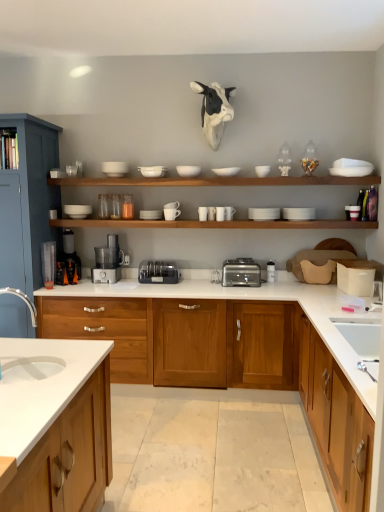
Image resolution: width=384 pixels, height=512 pixels. What do you see at coordinates (352, 212) in the screenshot?
I see `white matte cup at upper right, marked as the 14th tableware in a left-to-right arrangement` at bounding box center [352, 212].

This screenshot has width=384, height=512. Describe the element at coordinates (241, 273) in the screenshot. I see `silver metallic toaster at center` at that location.

In the scene shown: Measure the distance between point (x=260, y=172) and camera.

The distance of point (x=260, y=172) from camera is 3.59 meters.

Image resolution: width=384 pixels, height=512 pixels. Describe the element at coordinates (229, 213) in the screenshot. I see `white matte mug at center, marked as the tenth tableware in a left-to-right arrangement` at that location.

This screenshot has width=384, height=512. What are the coordinates of `white matte cup at upper right, positioned as the first tableware in right-to-left order` in the screenshot? It's located at (352, 212).

Which of these two, white glossy sink at lower left, the 2th sink positioned from the right, or white matte cup at center, the seventh tableware in the left-to-right sequence, is bigger?

white glossy sink at lower left, the 2th sink positioned from the right, is bigger.

In terms of width, does white glossy sink at lower left, which appears as the second sink when viewed from the back, look wider or thinner when compared to white matte cup at center, the seventh tableware in the left-to-right sequence?

white glossy sink at lower left, which appears as the second sink when viewed from the back, is wider than white matte cup at center, the seventh tableware in the left-to-right sequence.

Is point (0, 362) behind point (214, 210)?

No.

Measure the distance from white glossy sink at lower left, the 2th sink positioned from the right, to white matte cup at center, the 8th tableware when ordered from right to left.

white glossy sink at lower left, the 2th sink positioned from the right, and white matte cup at center, the 8th tableware when ordered from right to left, are 1.69 meters apart from each other.

Does matte gray bowl at center, the 3th tableware in the left-to-right sequence, come in front of white matte bowl at upper center, which is the 13th tableware in right-to-left order?

No, it is behind white matte bowl at upper center, which is the 13th tableware in right-to-left order.

From the image's perspective, is matte gray bowl at center, the 3th tableware in the left-to-right sequence, beneath white matte bowl at upper center, the second tableware positioned from the left?

Yes.

From a real-world perspective, is matte gray bowl at center, the 12th tableware when ordered from right to left, above or below white matte bowl at upper center, which is the 13th tableware in right-to-left order?

Clearly, from a real-world perspective, matte gray bowl at center, the 12th tableware when ordered from right to left, is below white matte bowl at upper center, which is the 13th tableware in right-to-left order.

Could you tell me if white matte cup at upper center, which is the 9th tableware from right to left, is facing matte gray bowl at center, the 3th tableware in the left-to-right sequence?

No, white matte cup at upper center, which is the 9th tableware from right to left, is not oriented towards matte gray bowl at center, the 3th tableware in the left-to-right sequence.

Is white matte cup at upper center, which is counted as the sixth tableware, starting from the left, taller or shorter than matte gray bowl at center, the 12th tableware when ordered from right to left?

Considering their sizes, white matte cup at upper center, which is counted as the sixth tableware, starting from the left, has more height than matte gray bowl at center, the 12th tableware when ordered from right to left.

How different are the orientations of white matte cup at upper center, which is the 9th tableware from right to left, and matte gray bowl at center, the 12th tableware when ordered from right to left, in degrees?

1.79 degrees.

Consider the image. From the image's perspective, relative to white glossy sink at lower left, placed as the 1th sink when sorted from front to back, is white glossy sink at lower right, the 2th sink positioned from the left, above or below?

From the image's perspective, white glossy sink at lower right, the 2th sink positioned from the left, appears below white glossy sink at lower left, placed as the 1th sink when sorted from front to back.

Consider the image. From a real-world perspective, is white glossy sink at lower right, the 2th sink positioned from the left, beneath white glossy sink at lower left, the 2th sink positioned from the right?

Yes, from a real-world perspective, white glossy sink at lower right, the 2th sink positioned from the left, is below white glossy sink at lower left, the 2th sink positioned from the right.

Who is taller, white glossy sink at lower right, marked as the 1th sink in a back-to-front arrangement, or white glossy sink at lower left, the first sink viewed from the left?

white glossy sink at lower left, the first sink viewed from the left, is taller.

In the image, is white glossy sink at lower right, the 1th sink positioned from the right, positioned in front of or behind white glossy sink at lower left, the first sink viewed from the left?

Visually, white glossy sink at lower right, the 1th sink positioned from the right, is located behind white glossy sink at lower left, the first sink viewed from the left.

Is satin silver food processor at center, which appears as the 1th coffee machine when viewed from the right, not within white matte bowl at upper center, which ranks as the ninth tableware in left-to-right order?

That's correct, satin silver food processor at center, which appears as the 1th coffee machine when viewed from the right, is outside of white matte bowl at upper center, which ranks as the ninth tableware in left-to-right order.

Considering the relative sizes of satin silver food processor at center, which appears as the 2th coffee machine when viewed from the left, and white matte bowl at upper center, which ranks as the ninth tableware in left-to-right order, in the image provided, is satin silver food processor at center, which appears as the 2th coffee machine when viewed from the left, taller than white matte bowl at upper center, which ranks as the ninth tableware in left-to-right order,?

Correct, satin silver food processor at center, which appears as the 2th coffee machine when viewed from the left, is much taller as white matte bowl at upper center, which ranks as the ninth tableware in left-to-right order.

Is point (99, 264) positioned behind point (230, 167)?

Yes.

Is satin silver food processor at center, which appears as the 2th coffee machine when viewed from the left, behind white matte bowl at upper center, which ranks as the ninth tableware in left-to-right order?

Yes, it is behind white matte bowl at upper center, which ranks as the ninth tableware in left-to-right order.

Looking at this image, can you tell me how much white matte cup at upper right, marked as the 14th tableware in a left-to-right arrangement, and white matte cup at center, the seventh tableware in the left-to-right sequence, differ in facing direction?

The angle between the facing direction of white matte cup at upper right, marked as the 14th tableware in a left-to-right arrangement, and the facing direction of white matte cup at center, the seventh tableware in the left-to-right sequence, is 0.000899 degrees.

From a real-world perspective, is white matte cup at upper right, marked as the 14th tableware in a left-to-right arrangement, physically located above or below white matte cup at center, the seventh tableware in the left-to-right sequence?

white matte cup at upper right, marked as the 14th tableware in a left-to-right arrangement, is above white matte cup at center, the seventh tableware in the left-to-right sequence.

How much distance is there between white matte cup at upper right, marked as the 14th tableware in a left-to-right arrangement, and white matte cup at center, the seventh tableware in the left-to-right sequence?

white matte cup at upper right, marked as the 14th tableware in a left-to-right arrangement, and white matte cup at center, the seventh tableware in the left-to-right sequence, are 1.14 meters apart.

Is point (347, 216) closer or farther from the camera than point (214, 211)?

Point (347, 216) is positioned closer to the camera compared to point (214, 211).

From the image's perspective, count 2nd sinks downward from the white matte plate at upper center, acting as the 3th tableware starting from the right, and point to it. Please provide its 2D coordinates.

[(362, 340)]

Is point (267, 213) less distant than point (365, 330)?

No, (267, 213) is further to viewer.

Between white matte plate at upper center, marked as the twelfth tableware in a left-to-right arrangement, and white glossy sink at lower right, marked as the 1th sink in a back-to-front arrangement, which one has more height?

white glossy sink at lower right, marked as the 1th sink in a back-to-front arrangement, is taller.

Based on the photo, which object is further away from the camera, white matte plate at upper center, acting as the 3th tableware starting from the right, or white glossy sink at lower right, the second sink viewed from the front?

white matte plate at upper center, acting as the 3th tableware starting from the right, is more distant.

In order to click on the 2nd sink in front of the white matte cup at center, the 8th tableware when ordered from right to left, starting your count from the anchor in this screenshot , I will do `click(23, 300)`.

Starting from the white matte bowl at upper center, which is the 13th tableware in right-to-left order, which tableware is the 1st one to the right? Please provide its 2D coordinates.

[(150, 214)]

When comparing their distances from white matte bowl at upper center, which ranks as the 14th tableware in right-to-left order, does white matte bowl at upper center, the second tableware positioned from the left, or white matte bowl at upper center, the 4th tableware positioned from the right, seem closer?

Based on the image, white matte bowl at upper center, the second tableware positioned from the left, appears to be nearer to white matte bowl at upper center, which ranks as the 14th tableware in right-to-left order.

Which object lies nearer to the anchor point white matte plate at upper center, marked as the twelfth tableware in a left-to-right arrangement, white matte cup at upper center, which is the 9th tableware from right to left, or white matte cup at center, the 8th tableware when ordered from right to left?

Based on the image, white matte cup at center, the 8th tableware when ordered from right to left, appears to be nearer to white matte plate at upper center, marked as the twelfth tableware in a left-to-right arrangement.

Which object lies nearer to the anchor point matte gray bowl at center, the 3th tableware in the left-to-right sequence, white matte bowl at upper center, placed as the eleventh tableware when sorted from left to right, or brushed metal cabinet at left, positioned as the third cabinetry in right-to-left order?

The object closer to matte gray bowl at center, the 3th tableware in the left-to-right sequence, is white matte bowl at upper center, placed as the eleventh tableware when sorted from left to right.

Based on the photo, when comparing their distances from silver metallic toaster at center, does white matte cup at upper right, positioned as the first tableware in right-to-left order, or satin black blender at center seem further?

white matte cup at upper right, positioned as the first tableware in right-to-left order, lies further to silver metallic toaster at center than the other object.

Based on their spatial positions, is brushed metal cabinet at left, the 1th cabinetry when ordered from left to right, or silver metallic toaster at center closer to white matte cup at upper center, which is counted as the sixth tableware, starting from the left?

silver metallic toaster at center lies closer to white matte cup at upper center, which is counted as the sixth tableware, starting from the left, than the other object.

Estimate the real-world distances between objects in this image. Which object is further from white glossy sink at lower left, which appears as the second sink when viewed from the back, white matte bowl at upper center, acting as the first tableware starting from the left, or white glossy sink at lower right, the second sink viewed from the front?

white glossy sink at lower right, the second sink viewed from the front, lies further to white glossy sink at lower left, which appears as the second sink when viewed from the back, than the other object.

Considering their positions, is brushed metal cabinet at left, positioned as the third cabinetry in right-to-left order, positioned further to white matte plate at upper center, marked as the twelfth tableware in a left-to-right arrangement, than satin black blender at center?

Based on the image, brushed metal cabinet at left, positioned as the third cabinetry in right-to-left order, appears to be further to white matte plate at upper center, marked as the twelfth tableware in a left-to-right arrangement.

Looking at the image, which one is located closer to satin silver food processor at center, which appears as the 1th coffee machine when viewed from the right, wooden cabinet at center, which appears as the second cabinetry when viewed from the left, or white matte cup at upper center, which is counted as the sixth tableware, starting from the left?

wooden cabinet at center, which appears as the second cabinetry when viewed from the left, is closer to satin silver food processor at center, which appears as the 1th coffee machine when viewed from the right.

The width and height of the screenshot is (384, 512). I want to click on shelf situated between matte gray bowl at center, the 3th tableware in the left-to-right sequence, and white matte bowl at upper center, which ranks as the ninth tableware in left-to-right order, from left to right, so click(214, 181).

I want to click on coffee machine between white matte bowl at upper center, which ranks as the 14th tableware in right-to-left order, and white matte cup at center, the 8th tableware when ordered from right to left, so click(108, 261).

The height and width of the screenshot is (512, 384). I want to click on toaster positioned between white glossy sink at lower left, the 2th sink positioned from the right, and black plastic coffee machine at lower left, which is the second coffee machine in right-to-left order, from near to far, so pyautogui.click(x=241, y=273).

Where is `sink between white matte bowl at upper center, which is the 13th tableware in right-to-left order, and white matte cup at upper right, marked as the 14th tableware in a left-to-right arrangement, from left to right`? The height and width of the screenshot is (512, 384). sink between white matte bowl at upper center, which is the 13th tableware in right-to-left order, and white matte cup at upper right, marked as the 14th tableware in a left-to-right arrangement, from left to right is located at coordinates (362, 340).